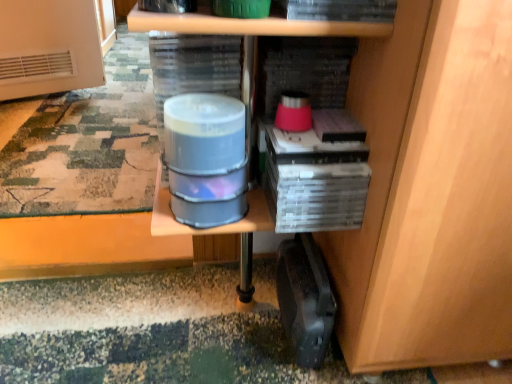
The height and width of the screenshot is (384, 512). What are the coordinates of `free space above camouflage fabric mat at lower left (from a real-world perspective)` in the screenshot? It's located at (96, 119).